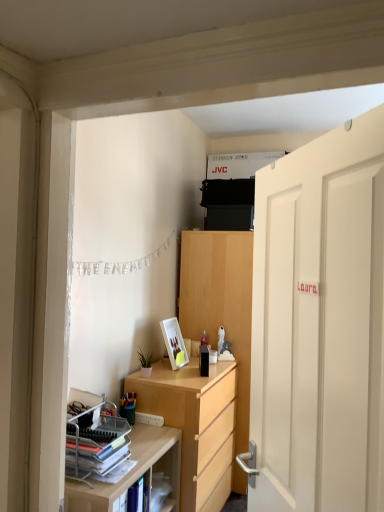
Image resolution: width=384 pixels, height=512 pixels. What do you see at coordinates (145, 362) in the screenshot?
I see `green matte plant at lower left` at bounding box center [145, 362].

Image resolution: width=384 pixels, height=512 pixels. I want to click on light wood shelf at lower left, so click(x=134, y=471).

The image size is (384, 512). What do you see at coordinates (193, 420) in the screenshot?
I see `light wood desk at center` at bounding box center [193, 420].

Measure the distance between silver metallic banner at upper left and camera.

The depth of silver metallic banner at upper left is 6.75 feet.

You are a GUI agent. You are given a task and a screenshot of the screen. Output one action in this format:
    pyautogui.click(x=<x>, y=<y>)
    Task: Click on the light wood cabinet at center
    The width and height of the screenshot is (384, 512).
    Given the screenshot: What is the action you would take?
    pyautogui.click(x=220, y=303)

Find the location of `white glossy picture frame at lower center`. white glossy picture frame at lower center is located at coordinates (174, 343).

Does white glossy picture frame at lower center lie behind light wood shelf at lower left?

That is True.

Is point (172, 353) positioned before point (102, 500)?

No.

From a real-world perspective, is white glossy picture frame at lower center positioned over light wood shelf at lower left based on gravity?

Yes.

Considering the sizes of objects white glossy picture frame at lower center and light wood shelf at lower left in the image provided, who is shorter, white glossy picture frame at lower center or light wood shelf at lower left?

white glossy picture frame at lower center is shorter.

Could you tell me if stacked matte paper at left is facing multicolored plastic pencil case at lower left?

No, stacked matte paper at left is not turned towards multicolored plastic pencil case at lower left.

Is stacked matte paper at left to the left of multicolored plastic pencil case at lower left from the viewer's perspective?

Yes.

Locate an element on the screen. This screenshot has width=384, height=512. book in front of the multicolored plastic pencil case at lower left is located at coordinates (97, 440).

Based on the photo, measure the distance from stacked matte paper at left to multicolored plastic pencil case at lower left.

stacked matte paper at left is 11.86 inches from multicolored plastic pencil case at lower left.

In the scene shown: Could light wood cabinet at center be considered to be inside multicolored plastic pencil case at lower left?

No, multicolored plastic pencil case at lower left does not contain light wood cabinet at center.

Is multicolored plastic pencil case at lower left facing away from light wood cabinet at center?

No, light wood cabinet at center is not at the back of multicolored plastic pencil case at lower left.

Can you confirm if multicolored plastic pencil case at lower left is taller than light wood cabinet at center?

No.

Is point (121, 412) in front of point (235, 326)?

Yes.

From a real-world perspective, relative to light wood desk at center, is stacked matte paper at left vertically above or below?

Clearly, from a real-world perspective, stacked matte paper at left is above light wood desk at center.

From the image's perspective, which is below, stacked matte paper at left or light wood desk at center?

light wood desk at center appears lower in the image.

In the scene shown: Is stacked matte paper at left shorter than light wood desk at center?

Indeed, stacked matte paper at left has a lesser height compared to light wood desk at center.

Considering the sizes of stacked matte paper at left and light wood desk at center in the image, is stacked matte paper at left wider or thinner than light wood desk at center?

Result: Considering their sizes, stacked matte paper at left looks slimmer than light wood desk at center.

Is light wood desk at center far from white matte door at right?

Indeed, light wood desk at center is not near white matte door at right.

Locate an element on the screen. Image resolution: width=384 pixels, height=512 pixels. desk below the white matte door at right (from the image's perspective) is located at coordinates (193, 420).

Looking at their sizes, would you say light wood desk at center is wider or thinner than white matte door at right?

In the image, light wood desk at center appears to be wider than white matte door at right.

Can you confirm if light wood desk at center is bigger than white matte door at right?

Yes, light wood desk at center is bigger than white matte door at right.

Is silver metallic banner at upper left beside white matte door at right?

They are not placed beside each other.

Does silver metallic banner at upper left appear on the right side of white matte door at right?

No, silver metallic banner at upper left is not to the right of white matte door at right.

Consider the image. Is silver metallic banner at upper left oriented away from white matte door at right?

That's not correct — silver metallic banner at upper left is not looking away from white matte door at right.

From the image's perspective, is silver metallic banner at upper left below white matte door at right?

No.

Is light wood shelf at lower left positioned in front of white matte door at right?

No, it is not.

Can you tell me how much light wood shelf at lower left and white matte door at right differ in facing direction?

The angle between the facing direction of light wood shelf at lower left and the facing direction of white matte door at right is 152 degrees.

Which is nearer, (171, 445) or (303, 198)?

The point (303, 198) is closer.

I want to click on shelf below the white matte door at right (from the image's perspective), so click(134, 471).

At what (x,y) coordinates should I click in order to perform the action: click on shelf located on the left of white glossy picture frame at lower center. Please return your answer as a coordinate pair (x, y). The image size is (384, 512). Looking at the image, I should click on (134, 471).

Find the location of a particular element. The width and height of the screenshot is (384, 512). stationery behind the stacked matte paper at left is located at coordinates (128, 406).

Considering their positions, is light wood shelf at lower left positioned closer to white glossy picture frame at lower center than green matte plant at lower left?

green matte plant at lower left.

Which object lies further to the anchor point stacked matte paper at left, silver metallic banner at upper left or green matte plant at lower left?

silver metallic banner at upper left is further to stacked matte paper at left.

In the scene shown: Looking at the image, which one is located closer to stacked matte paper at left, green matte plant at lower left or light wood desk at center?

light wood desk at center lies closer to stacked matte paper at left than the other object.

Considering their positions, is white matte door at right positioned further to silver metallic banner at upper left than light wood shelf at lower left?

white matte door at right is positioned further to the anchor silver metallic banner at upper left.

From the image, which object appears to be farther from silver metallic banner at upper left, green matte plant at lower left or white glossy picture frame at lower center?

Among the two, green matte plant at lower left is located further to silver metallic banner at upper left.

Looking at the image, which one is located closer to stacked matte paper at left, light wood shelf at lower left or multicolored plastic pencil case at lower left?

light wood shelf at lower left is closer to stacked matte paper at left.

Considering their positions, is light wood desk at center positioned further to light wood shelf at lower left than green matte plant at lower left?

Based on the image, green matte plant at lower left appears to be further to light wood shelf at lower left.

Estimate the real-world distances between objects in this image. Which object is closer to silver metallic banner at upper left, multicolored plastic pencil case at lower left or stacked matte paper at left?

Based on the image, multicolored plastic pencil case at lower left appears to be nearer to silver metallic banner at upper left.

Where is `book between silver metallic banner at upper left and light wood desk at center vertically`? This screenshot has width=384, height=512. book between silver metallic banner at upper left and light wood desk at center vertically is located at coordinates (97, 440).

Locate an element on the screen. picture frame between silver metallic banner at upper left and multicolored plastic pencil case at lower left in the vertical direction is located at coordinates (174, 343).

Locate an element on the screen. The height and width of the screenshot is (512, 384). book positioned between white matte door at right and white glossy picture frame at lower center from near to far is located at coordinates (97, 440).

This screenshot has height=512, width=384. What are the coordinates of `houseplant positioned between light wood shelf at lower left and white glossy picture frame at lower center from near to far` in the screenshot? It's located at (145, 362).